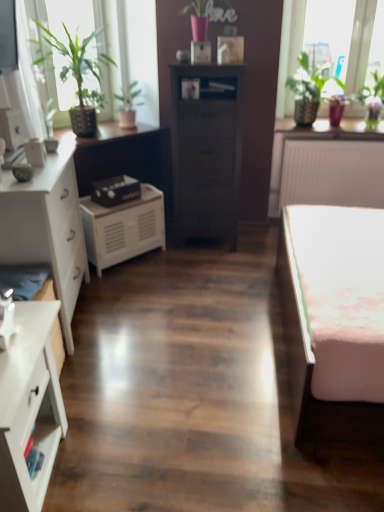
Question: Can you confirm if green glossy vase at upper right is positioned to the right of green leafy plant at upper right?

Choices:
 (A) no
 (B) yes

Answer: (B)

Question: Is the surface of green glossy vase at upper right in direct contact with green leafy plant at upper right?

Choices:
 (A) no
 (B) yes

Answer: (A)

Question: Does green glossy vase at upper right have a greater height compared to green leafy plant at upper right?

Choices:
 (A) yes
 (B) no

Answer: (B)

Question: Is green glossy vase at upper right aimed at green leafy plant at upper right?

Choices:
 (A) yes
 (B) no

Answer: (B)

Question: From a real-world perspective, is green glossy vase at upper right under green leafy plant at upper right?

Choices:
 (A) no
 (B) yes

Answer: (B)

Question: Can you confirm if green glossy vase at upper right is thinner than green leafy plant at upper right?

Choices:
 (A) yes
 (B) no

Answer: (B)

Question: Does white matte radiator at upper right touch dark wood cabinet at center, the first chest of drawers from the right?

Choices:
 (A) no
 (B) yes

Answer: (A)

Question: Does white matte radiator at upper right appear on the right side of dark wood cabinet at center, the first chest of drawers from the right?

Choices:
 (A) no
 (B) yes

Answer: (B)

Question: Does white matte radiator at upper right come behind dark wood cabinet at center, arranged as the third chest of drawers when viewed from the front?

Choices:
 (A) yes
 (B) no

Answer: (A)

Question: Is white matte radiator at upper right positioned with its back to dark wood cabinet at center, the 1th chest of drawers positioned from the back?

Choices:
 (A) yes
 (B) no

Answer: (B)

Question: Is white matte radiator at upper right not near dark wood cabinet at center, arranged as the third chest of drawers when viewed from the front?

Choices:
 (A) no
 (B) yes

Answer: (A)

Question: Is white matte radiator at upper right aimed at dark wood cabinet at center, arranged as the third chest of drawers when viewed from the front?

Choices:
 (A) no
 (B) yes

Answer: (A)

Question: Would you say white matte radiator at upper right contains green glossy vase at upper right?

Choices:
 (A) yes
 (B) no

Answer: (B)